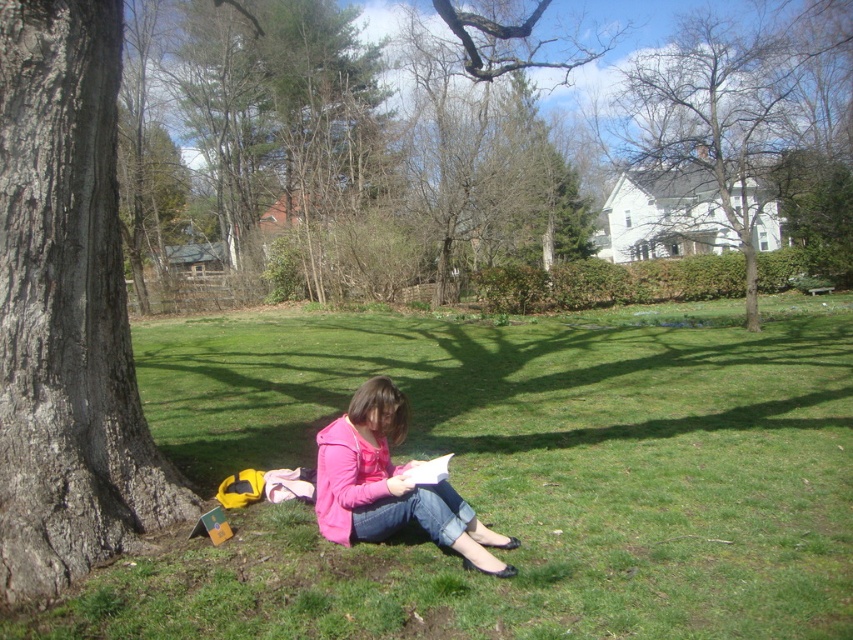
Measure the distance between green grass at lower left and pink matte jacket at center.

A distance of 12.32 feet exists between green grass at lower left and pink matte jacket at center.

Does green grass at lower left have a smaller size compared to pink matte jacket at center?

No, green grass at lower left is not smaller than pink matte jacket at center.

I want to click on green grass at lower left, so click(511, 476).

At what (x,y) coordinates should I click in order to perform the action: click on green grass at lower left. Please return your answer as a coordinate pair (x, y). Looking at the image, I should click on (511, 476).

Can you confirm if green grass at lower left is bigger than bare branches at upper center?

Incorrect, green grass at lower left is not larger than bare branches at upper center.

Is the position of green grass at lower left more distant than that of bare branches at upper center?

No, green grass at lower left is closer to the viewer.

Locate an element on the screen. Image resolution: width=853 pixels, height=640 pixels. green grass at lower left is located at coordinates (511, 476).

Between gray textured bark at left and bare branches at upper center, which one appears on the right side from the viewer's perspective?

Positioned to the right is bare branches at upper center.

Who is more forward, (65, 269) or (659, 92)?

Positioned in front is point (65, 269).

Describe the element at coordinates (67, 308) in the screenshot. I see `gray textured bark at left` at that location.

You are a GUI agent. You are given a task and a screenshot of the screen. Output one action in this format:
    pyautogui.click(x=<x>, y=<y>)
    Task: Click on the gray textured bark at left
    
    Given the screenshot: What is the action you would take?
    pyautogui.click(x=67, y=308)